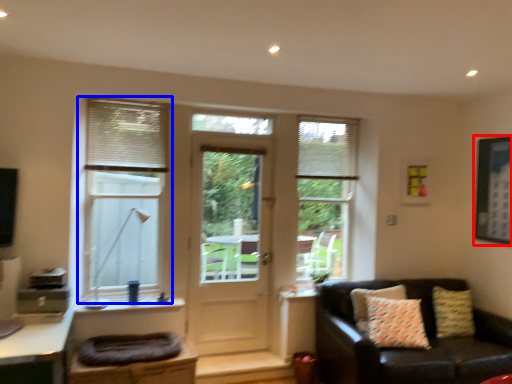
Question: Which point is further to the camera, picture frame (highlighted by a red box) or window (highlighted by a blue box)?

Choices:
 (A) picture frame
 (B) window

Answer: (A)